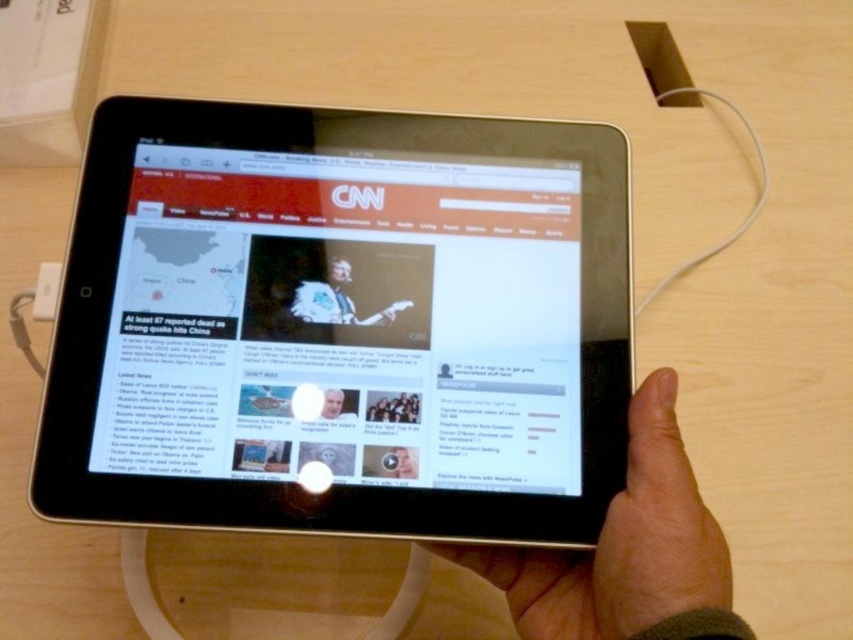
Question: Which point is closer to the camera taking this photo?

Choices:
 (A) 366,291
 (B) 436,552

Answer: (B)

Question: Is silver metallic tablet at center closer to camera compared to smooth skin hand at lower right?

Choices:
 (A) yes
 (B) no

Answer: (B)

Question: Where is silver metallic tablet at center located in relation to smooth skin hand at lower right in the image?

Choices:
 (A) right
 (B) left

Answer: (B)

Question: Which point is closer to the camera taking this photo?

Choices:
 (A) (636, 536)
 (B) (537, 301)

Answer: (A)

Question: Is silver metallic tablet at center smaller than smooth skin hand at lower right?

Choices:
 (A) yes
 (B) no

Answer: (B)

Question: Among these objects, which one is farthest from the camera?

Choices:
 (A) smooth skin hand at lower right
 (B) silver metallic tablet at center

Answer: (B)